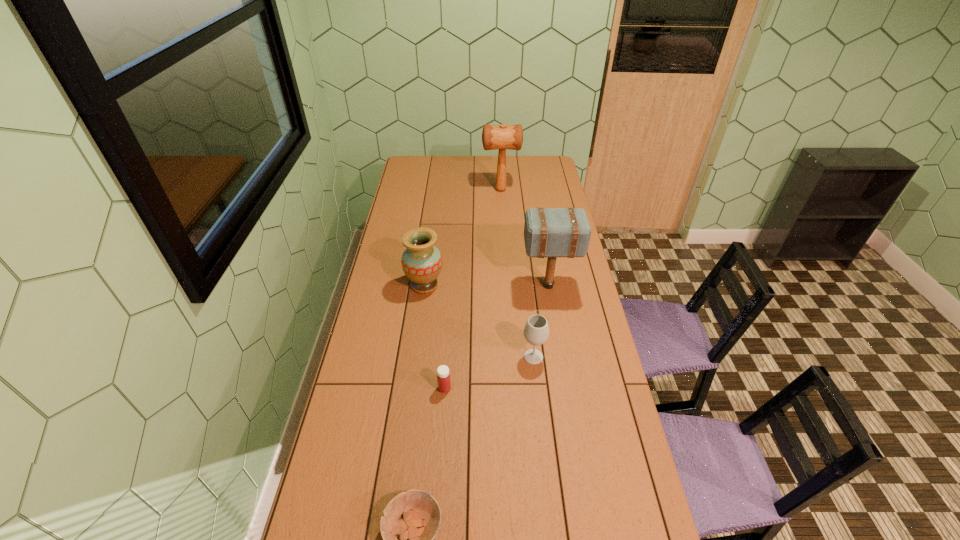
The image size is (960, 540). In order to click on free space that is in between the medicine and the nearer mallet in this screenshot , I will do `click(496, 337)`.

I want to click on free point between the fourth farthest object and the second shortest object, so click(489, 373).

The width and height of the screenshot is (960, 540). I want to click on empty space between the fourth shortest object and the nearer mallet, so click(487, 286).

The width and height of the screenshot is (960, 540). I want to click on free space between the third nearest object and the vase, so click(x=479, y=321).

Identify the location of empty space between the fifth farthest object and the farther mallet. The width and height of the screenshot is (960, 540). (472, 289).

Identify the location of vacant area that lies between the third nearest object and the fourth shortest object. (479, 321).

Locate which object is the fifth closest to the nearer mallet. Please provide its 2D coordinates. Your answer should be formatted as a tuple, i.e. [(x, y)], where the tuple contains the x and y coordinates of a point satisfying the conditions above.

[(420, 525)]

Find the location of a particular element. Image resolution: width=960 pixels, height=540 pixels. the fourth closest object to the third nearest object is located at coordinates (420, 525).

Find the location of a particular element. This screenshot has height=540, width=960. vacant space that satisfies the following two spatial constraints: 1. on the back side of the third nearest object; 2. on the left side of the second shortest object is located at coordinates (447, 356).